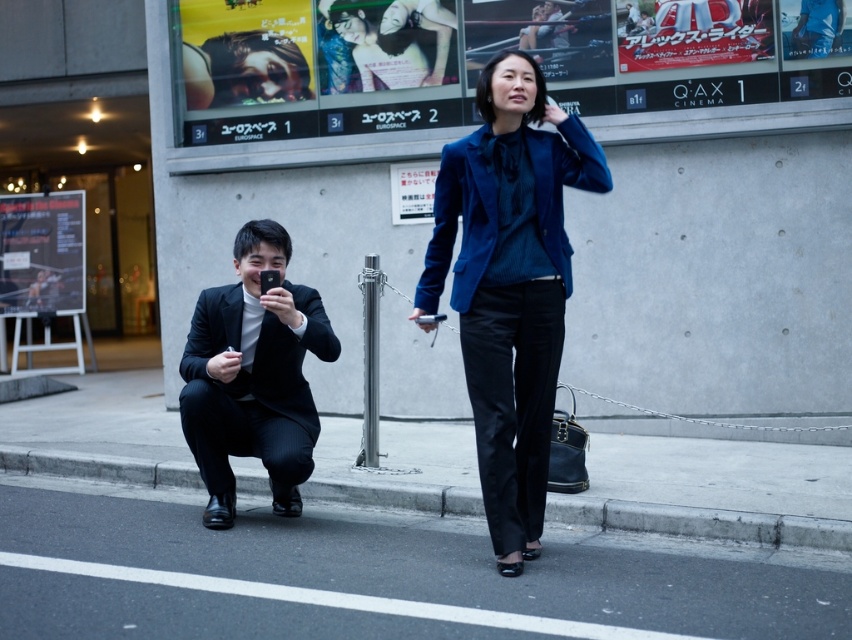
You are a fashion designer observing a street scene. You notice two outfits in the image. The velvet blue blazer at center and the matte black suit at lower left. Which outfit is taller in the image?

The velvet blue blazer at center is much taller than the matte black suit at lower left in the image.